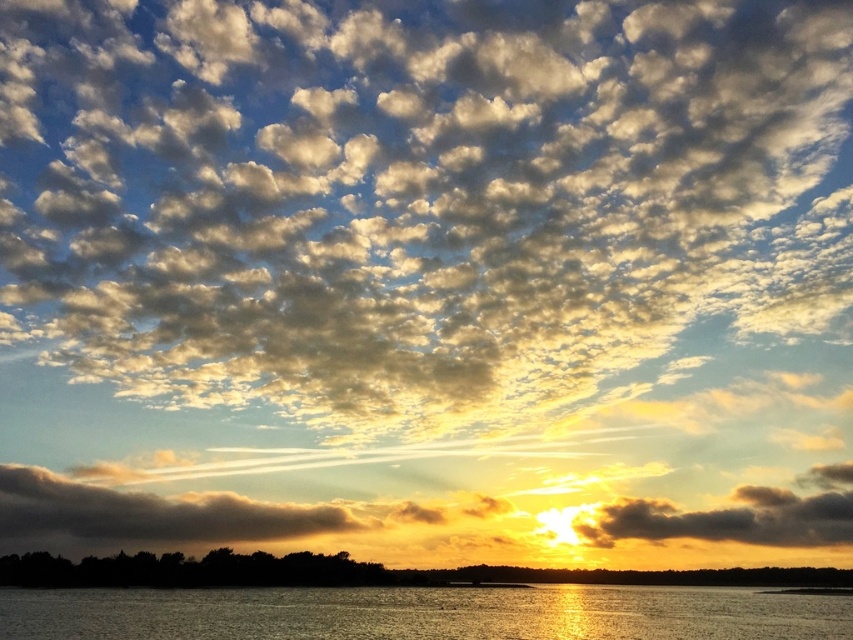
Question: Which point is farther from the camera taking this photo?

Choices:
 (A) (225, 584)
 (B) (795, 17)
 (C) (526, 608)
 (D) (759, 502)

Answer: (B)

Question: Is glistening silver water at lower center positioned before silhouetted trees at lower center?

Choices:
 (A) no
 (B) yes

Answer: (B)

Question: Based on their relative distances, which object is farther from the cloudy sky at upper center?

Choices:
 (A) silhouetted trees at lower center
 (B) glistening silver water at lower center

Answer: (B)

Question: Can you confirm if cloudy sky at upper center is thinner than glistening silver water at lower center?

Choices:
 (A) yes
 (B) no

Answer: (B)

Question: Observing the image, what is the correct spatial positioning of silhouetted trees at lower center in reference to dark gray fluffy cloud at lower right?

Choices:
 (A) left
 (B) right

Answer: (A)

Question: Which object is the closest to the cloudy sky at upper center?

Choices:
 (A) silhouetted trees at lower center
 (B) glistening silver water at lower center
 (C) dark gray fluffy cloud at lower right

Answer: (A)